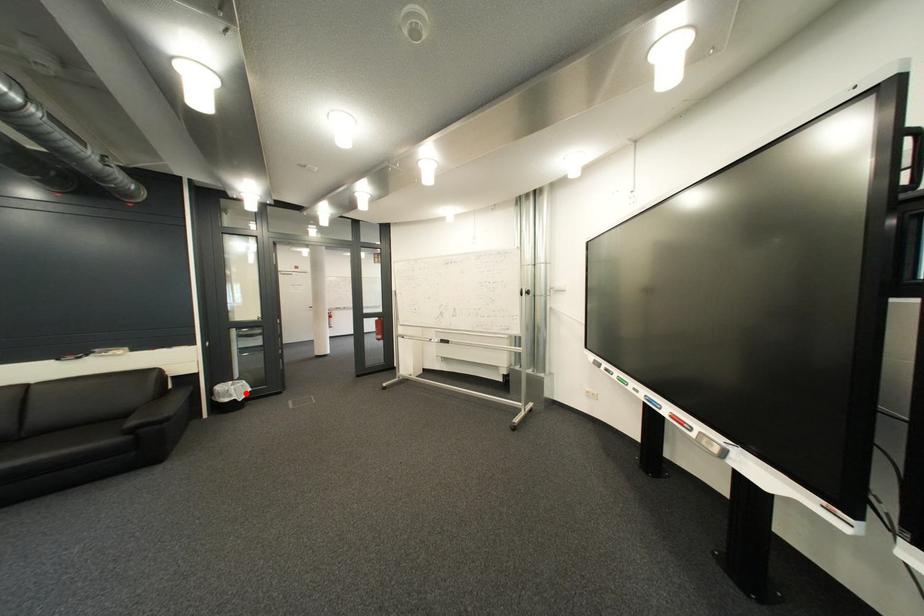
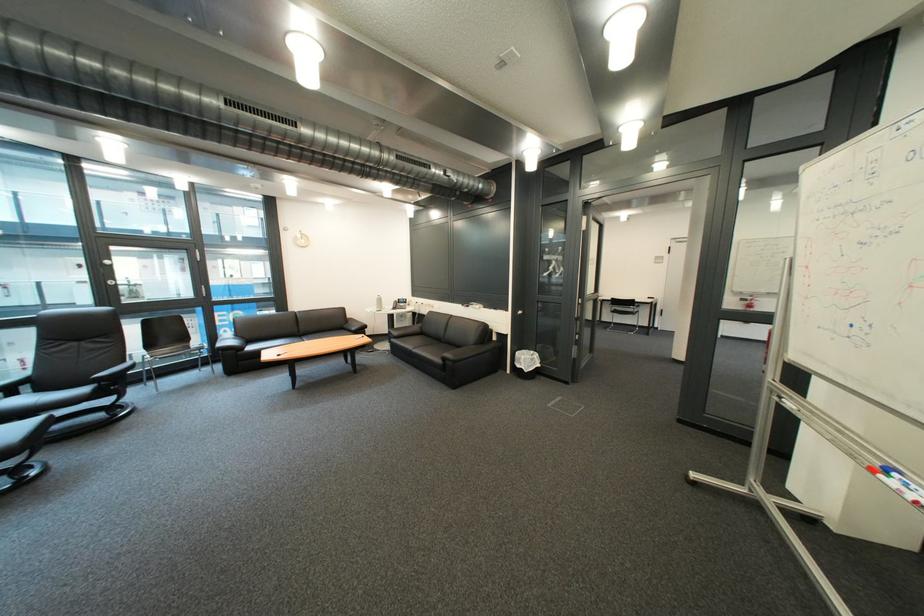
Question: I am providing you with two images of the same scene from different viewpoints. Given a red point in image1, look at the same physical point in image2. Is it:

Choices:
 (A) Closer to the viewpoint
 (B) Farther from the viewpoint

Answer: (B)